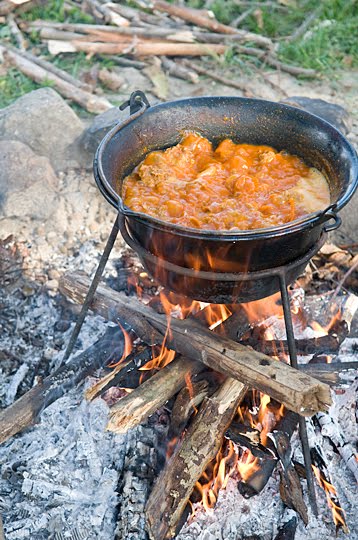
Locate an element on the screen. This screenshot has width=358, height=540. handles is located at coordinates (108, 182).